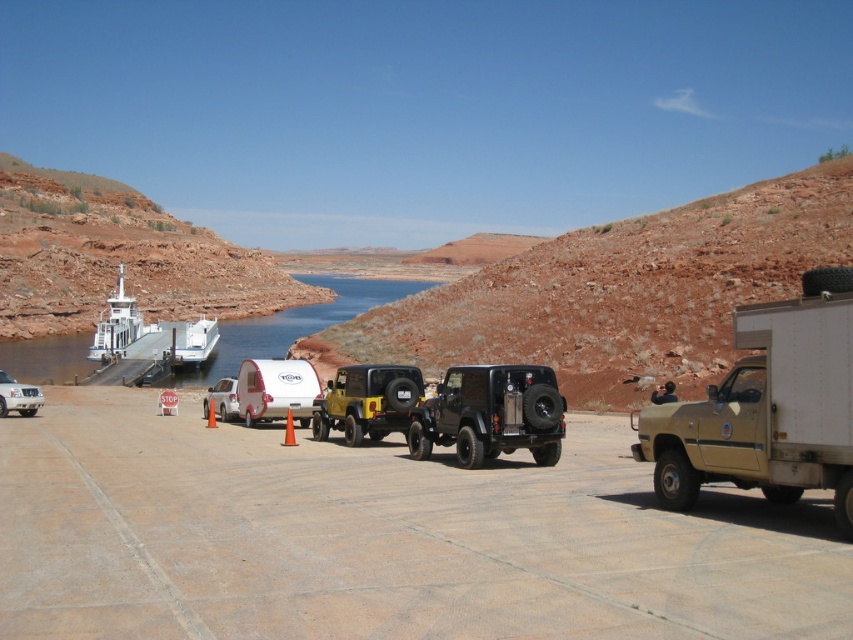
Is white matte camper at center in front of white matte boat at center?

Yes, it is in front of white matte boat at center.

Between white matte camper at center and white matte boat at center, which one appears on the left side from the viewer's perspective?

white matte boat at center is more to the left.

Which is behind, point (277, 358) or point (199, 336)?

The point (199, 336) is more distant.

The image size is (853, 640). I want to click on white matte camper at center, so click(265, 392).

Who is more distant from viewer, (468,374) or (151,326)?

Point (151,326)

Does matte black jeep at center have a larger size compared to white matte boat at center?

No.

Is point (473, 372) closer to camera compared to point (125, 291)?

Yes.

You are a GUI agent. You are given a task and a screenshot of the screen. Output one action in this format:
    pyautogui.click(x=<x>, y=<y>)
    Task: Click on the matte black jeep at center
    This screenshot has height=640, width=853.
    Given the screenshot: What is the action you would take?
    pyautogui.click(x=491, y=413)

The width and height of the screenshot is (853, 640). Describe the element at coordinates (367, 401) in the screenshot. I see `yellow matte jeep at center` at that location.

Which of these two, yellow matte jeep at center or silver metallic suv at left, stands shorter?

Answer: silver metallic suv at left is shorter.

Describe the element at coordinates (367, 401) in the screenshot. The height and width of the screenshot is (640, 853). I see `yellow matte jeep at center` at that location.

Where is `yellow matte jeep at center`? This screenshot has width=853, height=640. yellow matte jeep at center is located at coordinates [x=367, y=401].